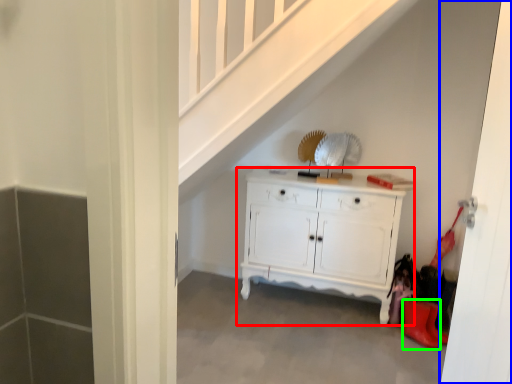
Question: Based on their relative distances, which object is farther from chest of drawers (highlighted by a red box)? Choose from door (highlighted by a blue box) and shoe (highlighted by a green box).

Choices:
 (A) door
 (B) shoe

Answer: (A)